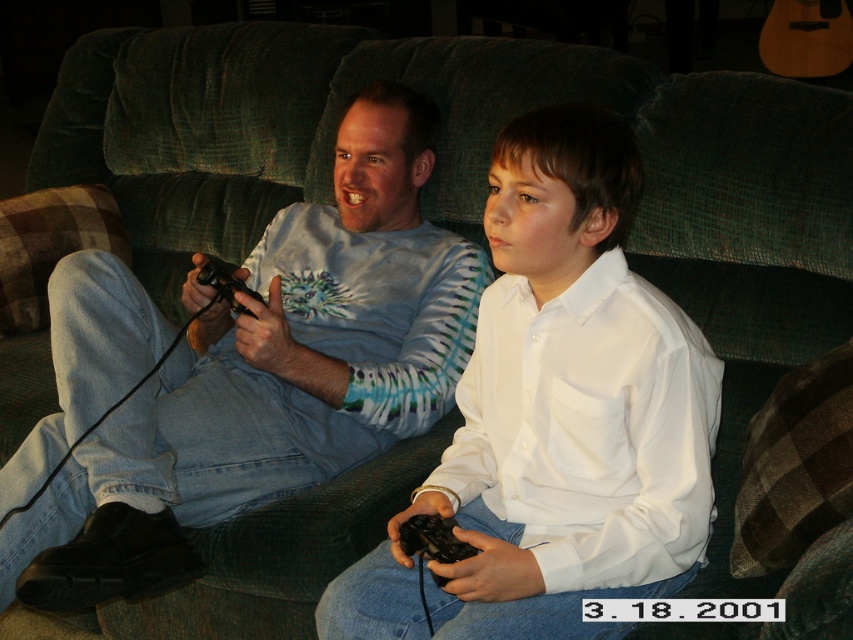
Can you confirm if tie-dye long-sleeve shirt at center is smaller than white matte shirt at center?

No.

The height and width of the screenshot is (640, 853). Describe the element at coordinates (242, 372) in the screenshot. I see `tie-dye long-sleeve shirt at center` at that location.

This screenshot has width=853, height=640. Describe the element at coordinates (242, 372) in the screenshot. I see `tie-dye long-sleeve shirt at center` at that location.

Find the location of `tie-dye long-sleeve shirt at center`. tie-dye long-sleeve shirt at center is located at coordinates (242, 372).